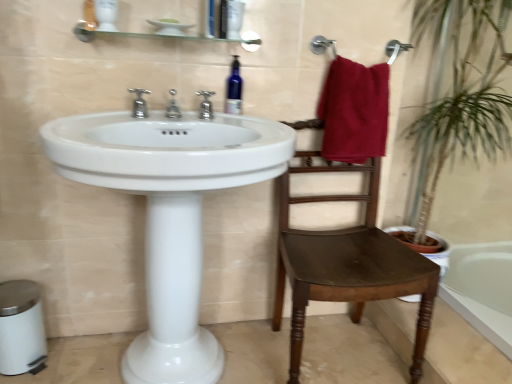
Locate an element on the screen. unoccupied region to the right of polished chrome faucet at center, the third tap positioned from the left is located at coordinates pos(245,124).